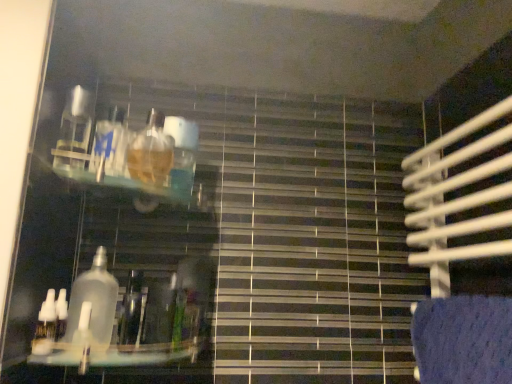
Question: In terms of height, does clear glass bottle at center, the second bottle positioned from the left, look taller or shorter compared to clear plastic bottle at lower left, which appears as the 2th bottle when viewed from the right?

Choices:
 (A) short
 (B) tall

Answer: (B)

Question: In terms of size, does clear glass bottle at center, the second bottle positioned from the left, appear bigger or smaller than clear plastic bottle at lower left, which appears as the 2th bottle when viewed from the right?

Choices:
 (A) small
 (B) big

Answer: (B)

Question: From the image's perspective, is clear glass bottle at center, which is the 1th bottle in right-to-left order, above or below clear plastic bottle at lower left, the 1th bottle positioned from the left?

Choices:
 (A) below
 (B) above

Answer: (B)

Question: Is clear plastic bottle at lower left, which appears as the 2th bottle when viewed from the right, taller or shorter than clear glass bottle at center, the second bottle positioned from the left?

Choices:
 (A) tall
 (B) short

Answer: (B)

Question: Considering their positions, is clear plastic bottle at lower left, which appears as the 2th bottle when viewed from the right, located in front of or behind clear glass bottle at center, which is the 1th bottle in right-to-left order?

Choices:
 (A) behind
 (B) front

Answer: (A)

Question: From the image's perspective, relative to clear glass bottle at center, the second bottle positioned from the left, is clear plastic bottle at lower left, which appears as the 2th bottle when viewed from the right, above or below?

Choices:
 (A) above
 (B) below

Answer: (B)

Question: From a real-world perspective, is clear plastic bottle at lower left, which appears as the 2th bottle when viewed from the right, above or below clear glass bottle at center, which is the 1th bottle in right-to-left order?

Choices:
 (A) below
 (B) above

Answer: (A)